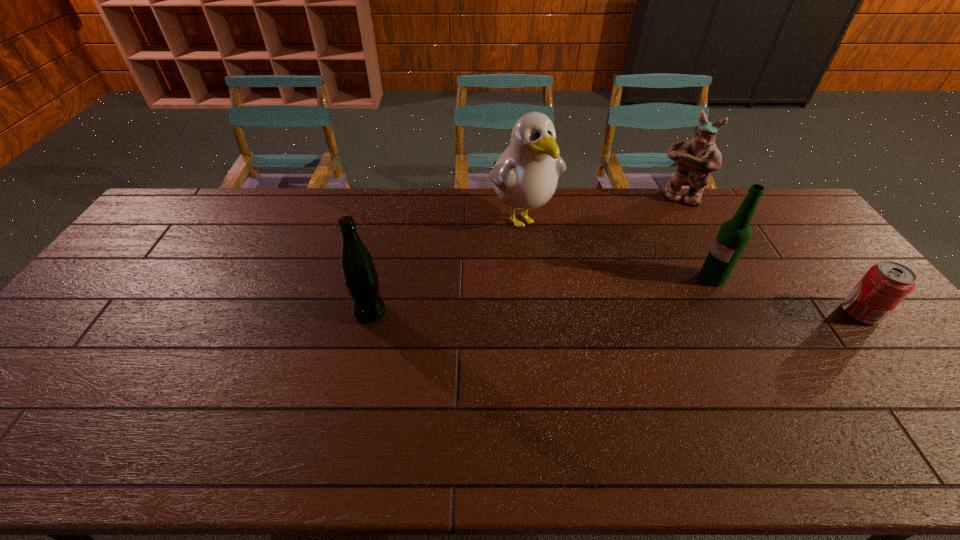
I want to click on vacant position in the image that satisfies the following two spatial constraints: 1. on the back side of the figurine; 2. on the right side of the farther beer bottle, so click(670, 198).

This screenshot has width=960, height=540. What are the coordinates of `vacant space that satisfies the following two spatial constraints: 1. on the front side of the rightmost object; 2. on the left side of the farther beer bottle` in the screenshot? It's located at (731, 313).